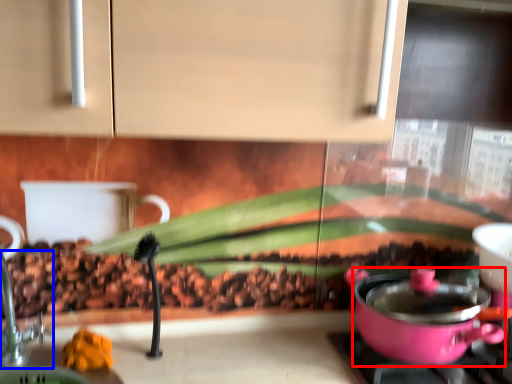
Question: Which of the following is the farthest to the observer, kitchen appliance (highlighted by a red box) or faucet (highlighted by a blue box)?

Choices:
 (A) kitchen appliance
 (B) faucet

Answer: (A)